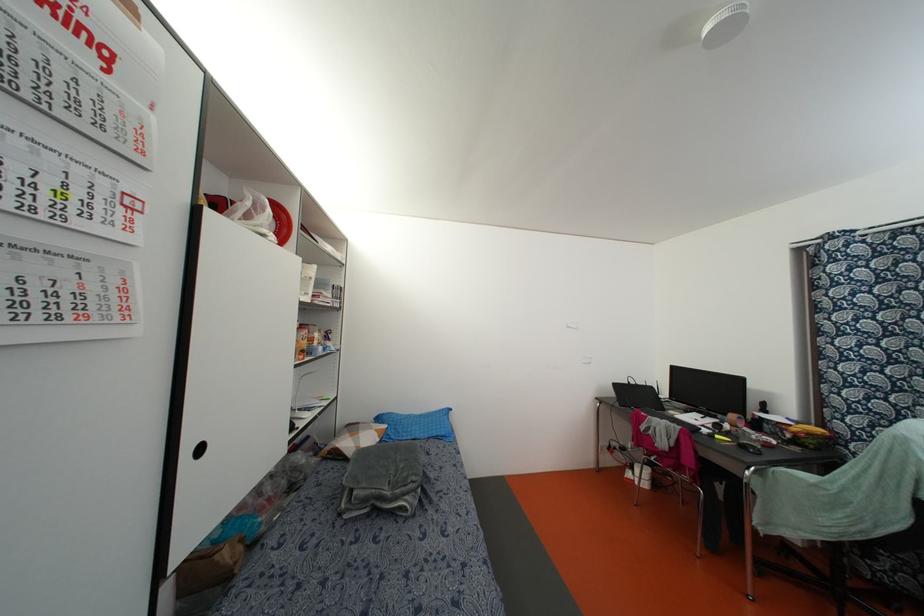
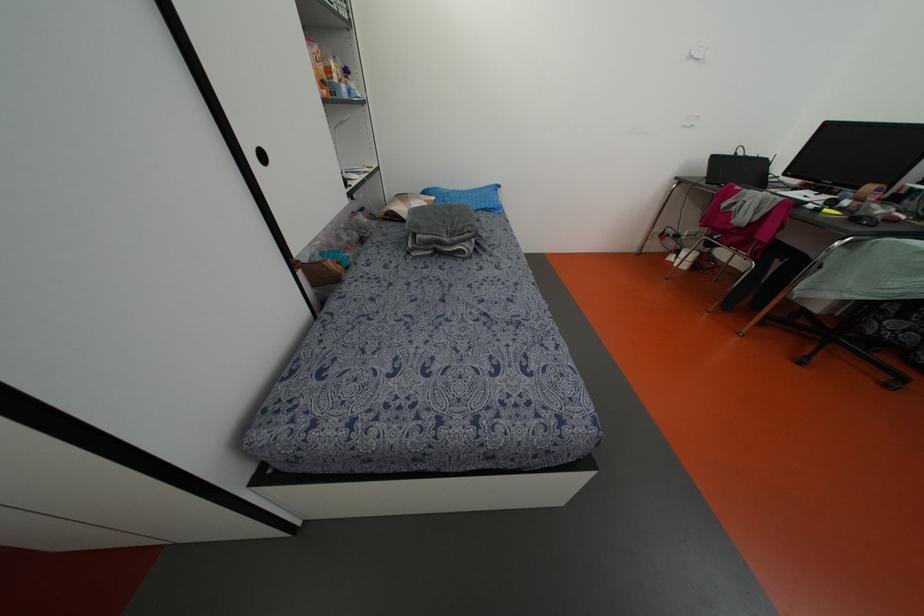
The point at (x=351, y=427) is marked in the first image. Where is the corresponding point in the second image?

(402, 197)